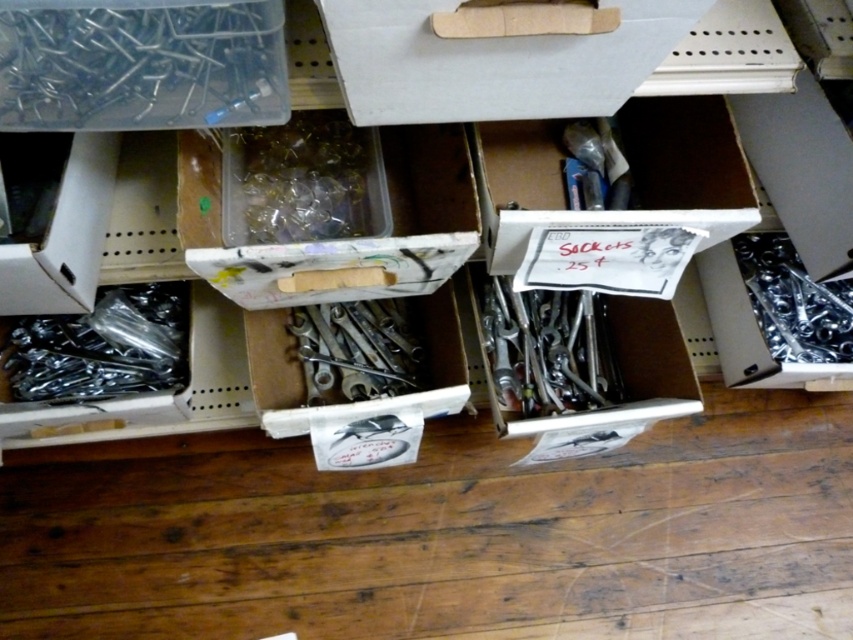
Image resolution: width=853 pixels, height=640 pixels. Describe the element at coordinates (141, 64) in the screenshot. I see `clear plastic nails at upper left` at that location.

Does point (41, 42) come closer to viewer compared to point (556, 378)?

Yes, it is in front of point (556, 378).

Measure the distance between clear plastic nails at upper left and camera.

clear plastic nails at upper left is 21.78 inches from camera.

Identify the location of clear plastic nails at upper left. The image size is (853, 640). (141, 64).

Where is `metallic silver wrenches at left`? This screenshot has width=853, height=640. metallic silver wrenches at left is located at coordinates (102, 348).

Which of these two, metallic silver wrenches at left or metallic silver socket at right, stands taller?

Standing taller between the two is metallic silver socket at right.

Measure the distance between point (109, 365) and camera.

3.69 feet

The image size is (853, 640). Find the location of `metallic silver wrenches at left`. metallic silver wrenches at left is located at coordinates (102, 348).

Between point (125, 54) and point (802, 323), which one is positioned behind?

Positioned behind is point (802, 323).

Can you confirm if clear plastic nails at upper left is positioned above metallic silver socket at right?

Correct, clear plastic nails at upper left is located above metallic silver socket at right.

Which is behind, point (218, 81) or point (805, 296)?

The point (805, 296) is more distant.

In order to click on clear plastic nails at upper left in this screenshot , I will do `click(141, 64)`.